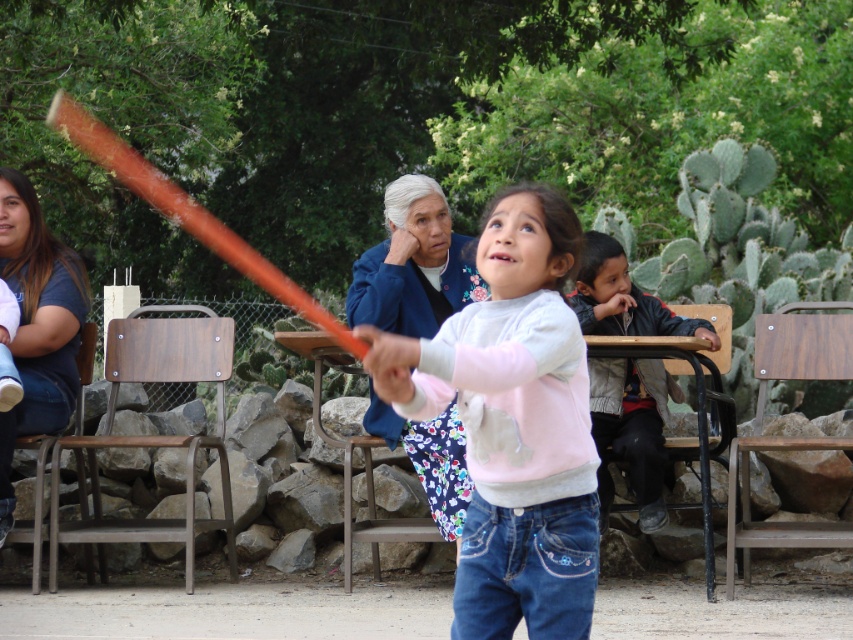
Question: Among these points, which one is nearest to the camera?

Choices:
 (A) [392, 438]
 (B) [590, 275]

Answer: (A)

Question: Which object is farther from the camera taking this photo?

Choices:
 (A) matte pink sweater at center
 (B) dark blue t-shirt at left

Answer: (B)

Question: Is blue floral dress at center below dark gray jacket at right?

Choices:
 (A) yes
 (B) no

Answer: (B)

Question: Considering the relative positions of matte pink sweater at center and dark blue t-shirt at left in the image provided, where is matte pink sweater at center located with respect to dark blue t-shirt at left?

Choices:
 (A) right
 (B) left

Answer: (A)

Question: Which object is the farthest from the dark blue t-shirt at left?

Choices:
 (A) matte pink sweater at center
 (B) dark gray jacket at right
 (C) blue floral dress at center

Answer: (A)

Question: From the image, what is the correct spatial relationship of blue floral dress at center in relation to dark blue t-shirt at left?

Choices:
 (A) right
 (B) left

Answer: (A)